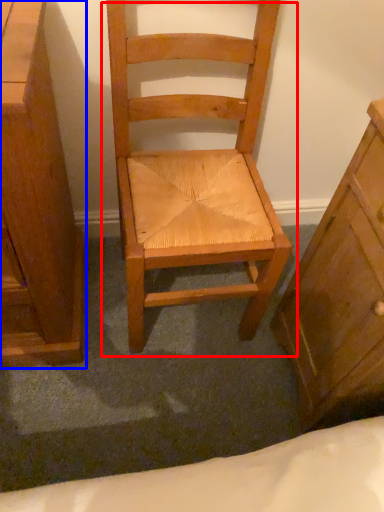
Question: Which object appears farthest to the camera in this image, chair (highlighted by a red box) or chest of drawers (highlighted by a blue box)?

Choices:
 (A) chair
 (B) chest of drawers

Answer: (A)